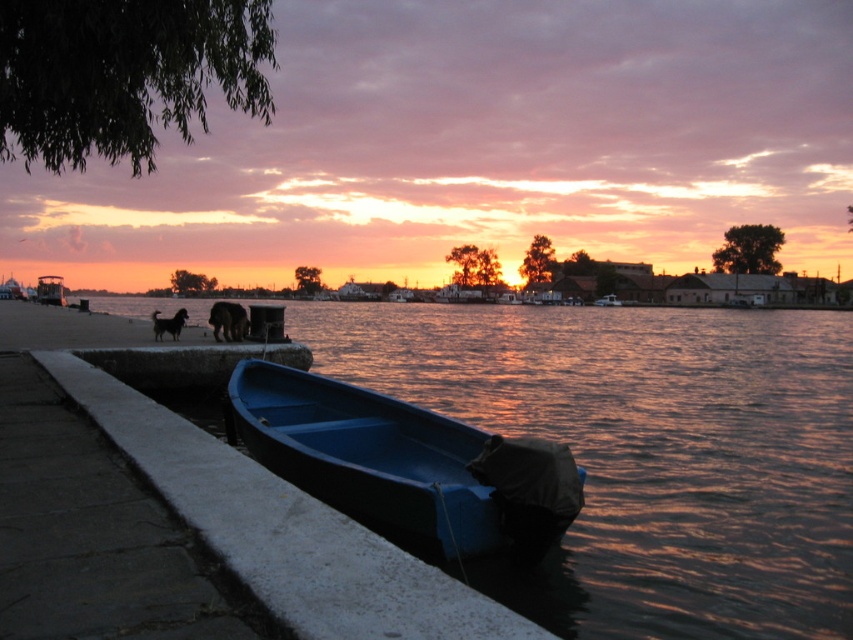
The image size is (853, 640). Find the location of `smooth concrete ledge at lower left`. smooth concrete ledge at lower left is located at coordinates (270, 512).

Who is more distant from viewer, (132, 381) or (560, 502)?

The point (132, 381) is behind.

The image size is (853, 640). I want to click on smooth concrete ledge at lower left, so click(270, 512).